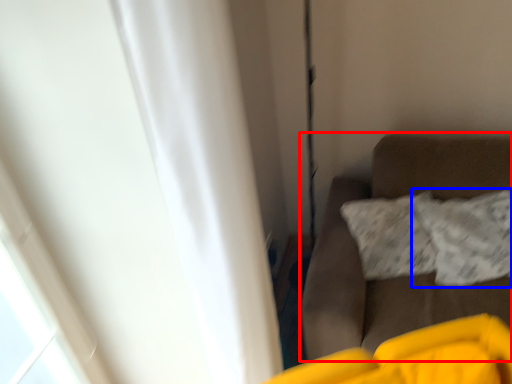
Question: Which object appears closest to the camera in this image, furniture (highlighted by a red box) or pillow (highlighted by a blue box)?

Choices:
 (A) furniture
 (B) pillow

Answer: (A)